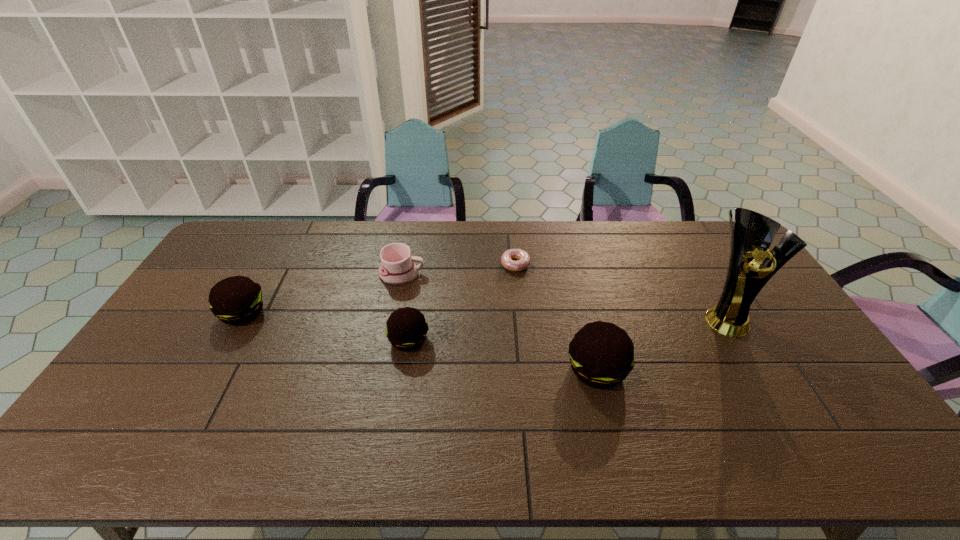
Locate an element on the screen. This screenshot has height=540, width=960. vacant space at the left edge is located at coordinates (190, 363).

You are a GUI agent. You are given a task and a screenshot of the screen. Output one action in this format:
    pyautogui.click(x=<x>, y=<y>)
    Task: Click on the free spot at the right edge of the desktop
    
    Given the screenshot: What is the action you would take?
    pyautogui.click(x=774, y=343)

The width and height of the screenshot is (960, 540). Find the location of `unoccupied position between the shortest patty and the rightmost object`. unoccupied position between the shortest patty and the rightmost object is located at coordinates (566, 328).

Identify the location of free space that is in between the shortest object and the award. (619, 290).

Where is `free area in between the leftmost patty and the shortest patty`? The width and height of the screenshot is (960, 540). free area in between the leftmost patty and the shortest patty is located at coordinates coord(325,327).

You are a GUI agent. You are given a task and a screenshot of the screen. Output one action in this format:
    pyautogui.click(x=<x>, y=<y>)
    Task: Click on the free space between the doughnut and the leftmost patty
    
    Given the screenshot: What is the action you would take?
    pyautogui.click(x=379, y=289)

Identify the location of free spot between the doughnut and the award. The height and width of the screenshot is (540, 960). (619, 290).

Where is `vacant space in between the rightmost object and the mug`? This screenshot has height=540, width=960. vacant space in between the rightmost object and the mug is located at coordinates (563, 295).

You are a GUI agent. You are given a task and a screenshot of the screen. Output one action in this format:
    pyautogui.click(x=<x>, y=<y>)
    Task: Click on the unoccupied position between the second object from right to left and the third object from right to left
    This screenshot has width=960, height=540.
    Given the screenshot: What is the action you would take?
    pyautogui.click(x=556, y=318)

I want to click on vacant space that's between the second patty from right to left and the rightmost patty, so click(x=503, y=355).